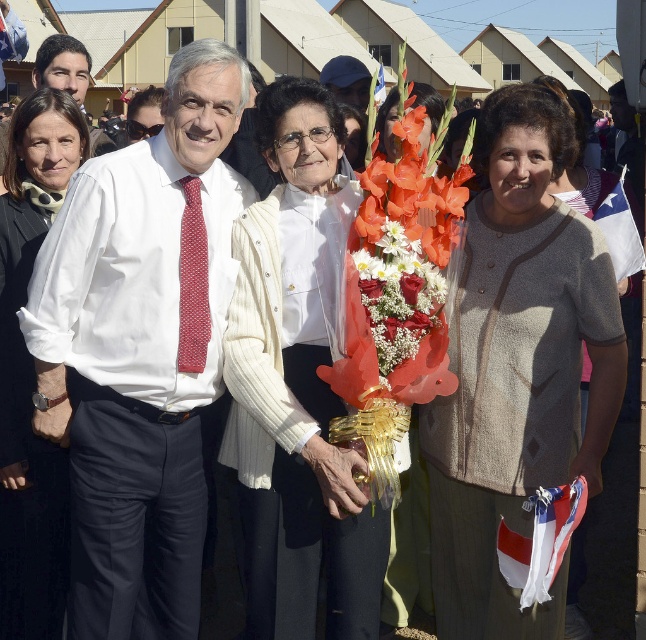
Is point (360, 563) less distant than point (395, 300)?

No, (360, 563) is behind (395, 300).

This screenshot has height=640, width=646. Describe the element at coordinates (295, 392) in the screenshot. I see `white knit cardigan at center` at that location.

At what (x,y) coordinates should I click in order to perform the action: click on white knit cardigan at center. Please return your answer as a coordinate pair (x, y). The width and height of the screenshot is (646, 640). Looking at the image, I should click on (x=295, y=392).

Does white shirt at center appear on the right side of beige knitted sweater at center?

In fact, white shirt at center is to the left of beige knitted sweater at center.

Is point (149, 259) positioned behind point (563, 342)?

Yes, point (149, 259) is behind point (563, 342).

Image resolution: width=646 pixels, height=640 pixels. In order to click on white shirt at center in this screenshot , I will do `click(141, 349)`.

Find the location of a particular element. white shirt at center is located at coordinates (141, 349).

Describe the element at coordinates (141, 349) in the screenshot. I see `white shirt at center` at that location.

Does point (211, 268) come in front of point (373, 92)?

That is False.

Image resolution: width=646 pixels, height=640 pixels. I want to click on white shirt at center, so click(141, 349).